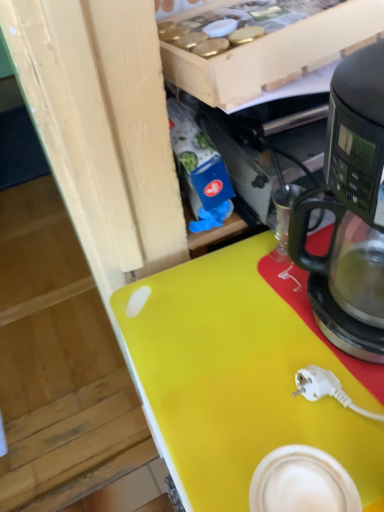
At what (x,y) coordinates should I click in order to perform the action: click on free point above yellow matte desk at center (from a real-world perspective). Please return your answer as a coordinate pair (x, y). Looking at the image, I should click on (277, 316).